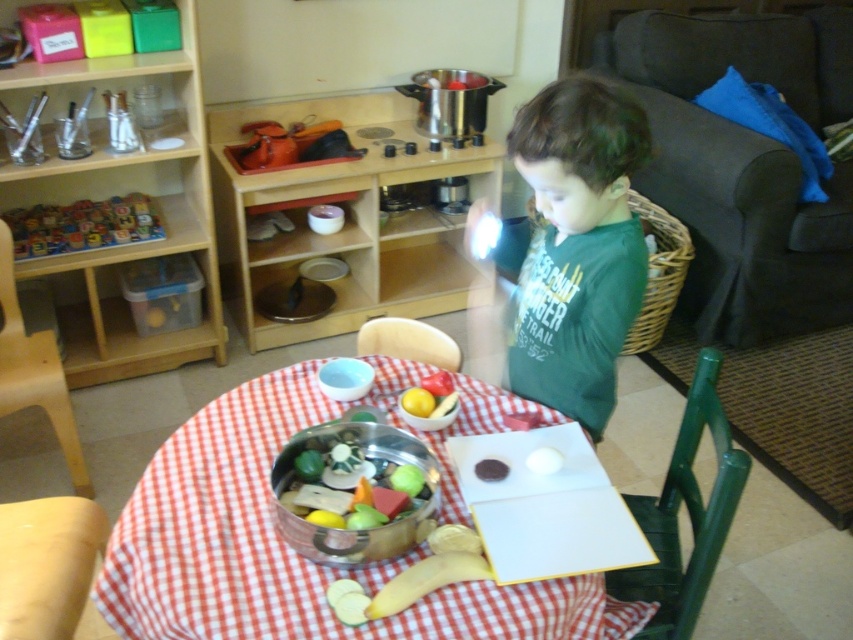
The point at coordinates (x=575, y=244) is located on which object in the scene?

The point at coordinates (x=575, y=244) is on the green cotton shirt at center.

You are a parent trying to ensure your child can safely reach both the green cotton shirt at center and the shiny metallic pot at center. Given that the child can comfortably reach items within 18 inches, can they comfortably reach both objects?

The distance between the green cotton shirt at center and the shiny metallic pot at center is 18.23 inches. Since the child can comfortably reach items within 18 inches, they may not be able to comfortably reach both objects as the distance exceeds their comfortable reach range.

Based on the photo, you are standing in the playroom and see two points on the table. Which point, point [579,384] or point [294,449], is closer to you?

Point [294,449] is closer to you because it is less further to the camera than point [579,384].